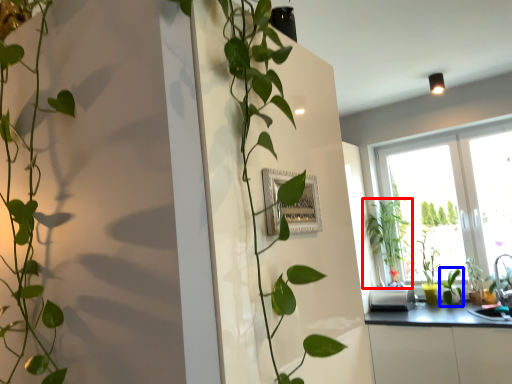
Question: Which of the following is the farthest to the observer, houseplant (highlighted by a red box) or plant (highlighted by a blue box)?

Choices:
 (A) houseplant
 (B) plant

Answer: (A)